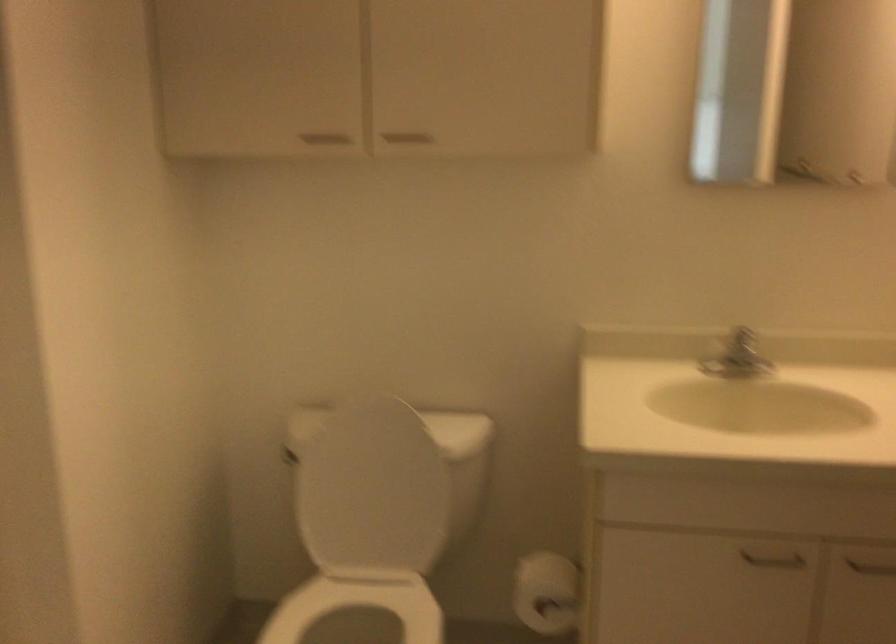
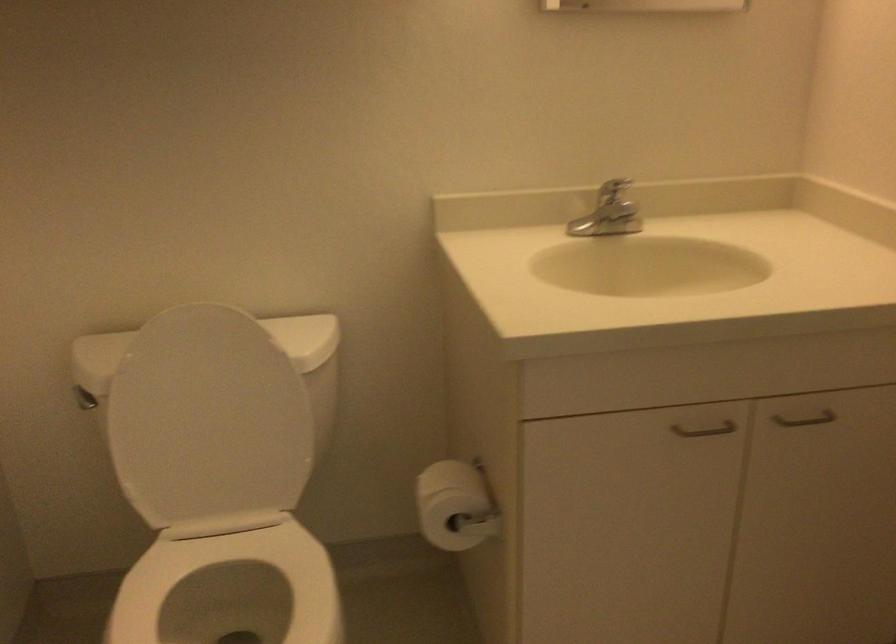
Question: The camera is either moving clockwise (left) or counter-clockwise (right) around the object. The first image is from the beginning of the video and the second image is from the end. Is the camera moving left or right when shooting the video?

Choices:
 (A) Left
 (B) Right

Answer: (A)